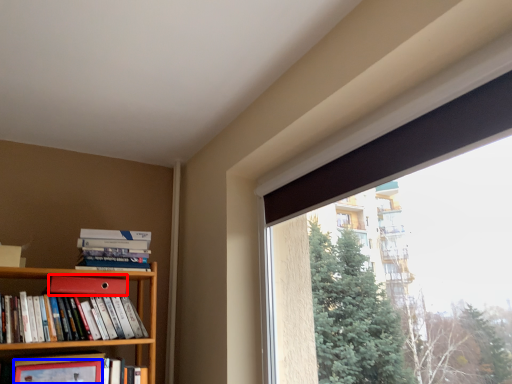
Question: Which point is closer to the camera, paperback book (highlighted by a red box) or paperback book (highlighted by a blue box)?

Choices:
 (A) paperback book
 (B) paperback book

Answer: (B)